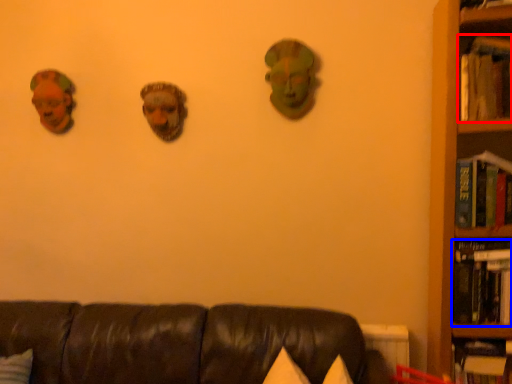
Question: Among these objects, which one is farthest to the camera, book (highlighted by a red box) or book (highlighted by a blue box)?

Choices:
 (A) book
 (B) book

Answer: (B)